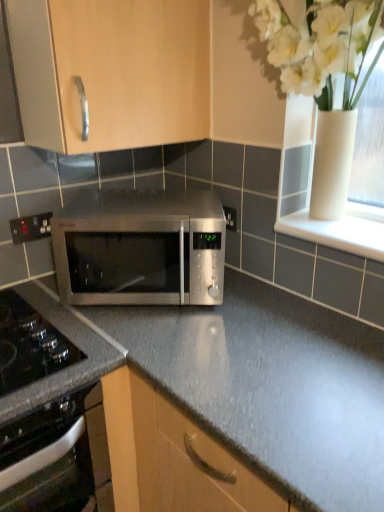
Question: Which is correct: black plastic electrical outlet at lower left is inside white glossy window sill at upper right, or outside of it?

Choices:
 (A) outside
 (B) inside

Answer: (A)

Question: From the image's perspective, is black plastic electrical outlet at lower left located above or below white glossy window sill at upper right?

Choices:
 (A) above
 (B) below

Answer: (A)

Question: Estimate the real-world distances between objects in this image. Which object is closer to the black plastic electrical outlet at lower left?

Choices:
 (A) stainless steel microwave at center
 (B) white glossy vase at upper right
 (C) black glass oven at lower left
 (D) white glossy window sill at upper right
 (E) matte wood cabinet at upper center

Answer: (A)

Question: Based on their relative distances, which object is farther from the black glass oven at lower left?

Choices:
 (A) matte wood cabinet at upper center
 (B) white glossy window sill at upper right
 (C) white glossy vase at upper right
 (D) stainless steel microwave at center
 (E) black plastic electrical outlet at lower left

Answer: (C)